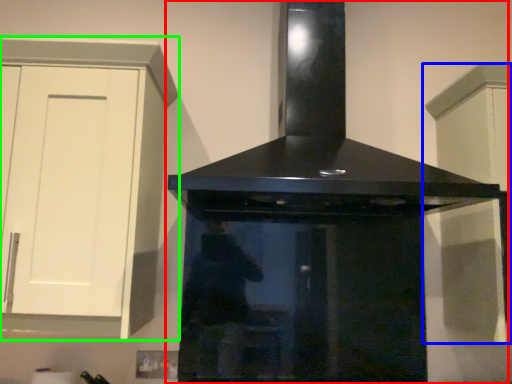
Question: Which object is positioned farthest from home appliance (highlighted by a red box)? Select from cabinetry (highlighted by a blue box) and cabinetry (highlighted by a green box).

Choices:
 (A) cabinetry
 (B) cabinetry

Answer: (B)